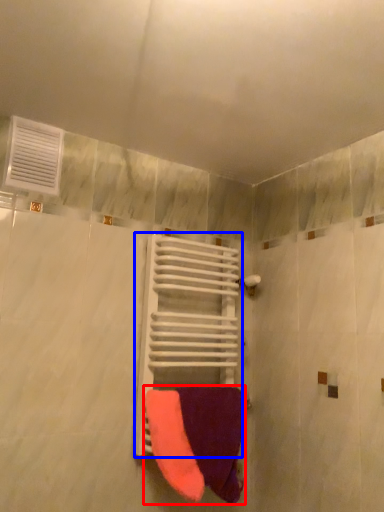
Question: Which point is further to the camera, towel (highlighted by a red box) or balustrade (highlighted by a blue box)?

Choices:
 (A) towel
 (B) balustrade

Answer: (B)